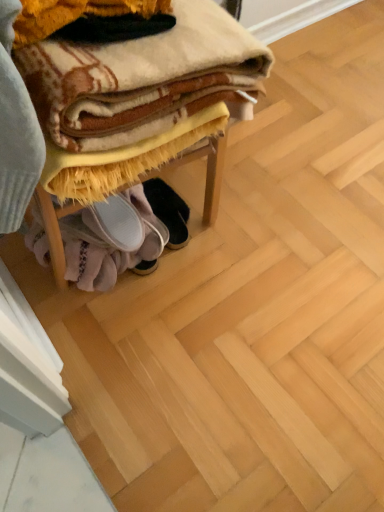
What do you see at coordinates (139, 74) in the screenshot? The width and height of the screenshot is (384, 512). I see `soft white bath towel at center` at bounding box center [139, 74].

At what (x,y) coordinates should I click in order to perform the action: click on soft white bath towel at center. Please return your answer as a coordinate pair (x, y). This screenshot has width=384, height=512. Looking at the image, I should click on (139, 74).

I want to click on soft white bath towel at center, so click(139, 74).